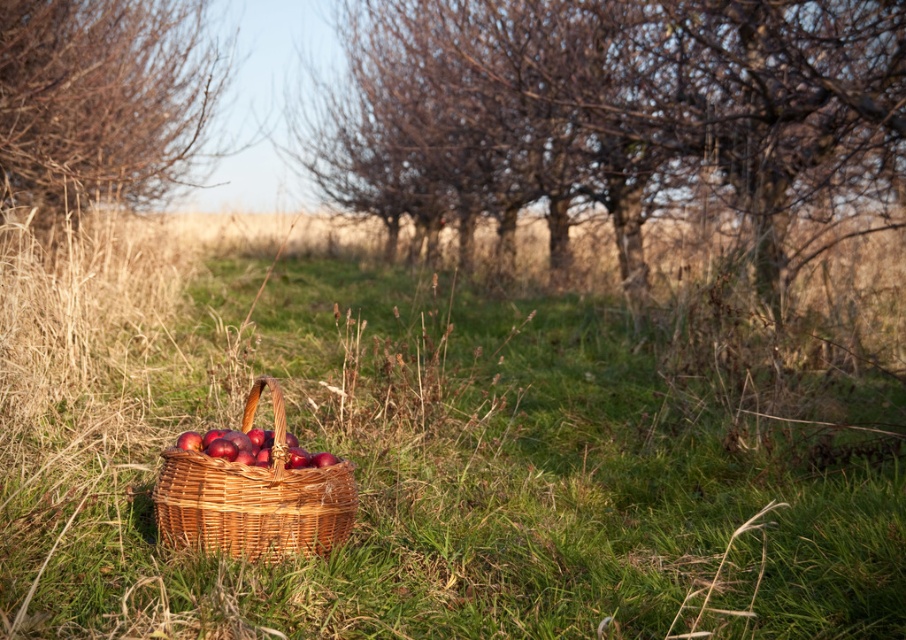
You are standing at the center of the image and want to place a small flag exactly where the woven brown basket at center is located. According to the coordinates provided, what are the coordinates you should aim for?

The coordinates for the woven brown basket at center are exactly at point (x=253, y=497), so you should aim for those coordinates to place the flag.

You are planning to place a small toy on the green grass at center where the shiny red apples at center are also present. Which object would the toy most likely cover more area if placed there?

The green grass at center is wider than the shiny red apples at center, so the toy would most likely cover more area of the green grass at center.